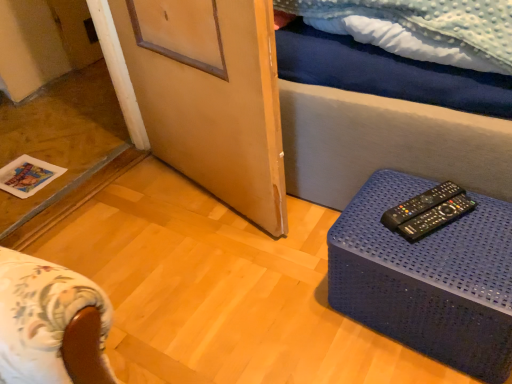
You are a GUI agent. You are given a task and a screenshot of the screen. Output one action in this format:
    pyautogui.click(x=<x>, y=<y>)
    Task: Click on the vacant area that is situated to the right of black plastic remote controls at right, which ranks as the 1th remote control in front-to-back order
    
    Given the screenshot: What is the action you would take?
    pyautogui.click(x=484, y=217)